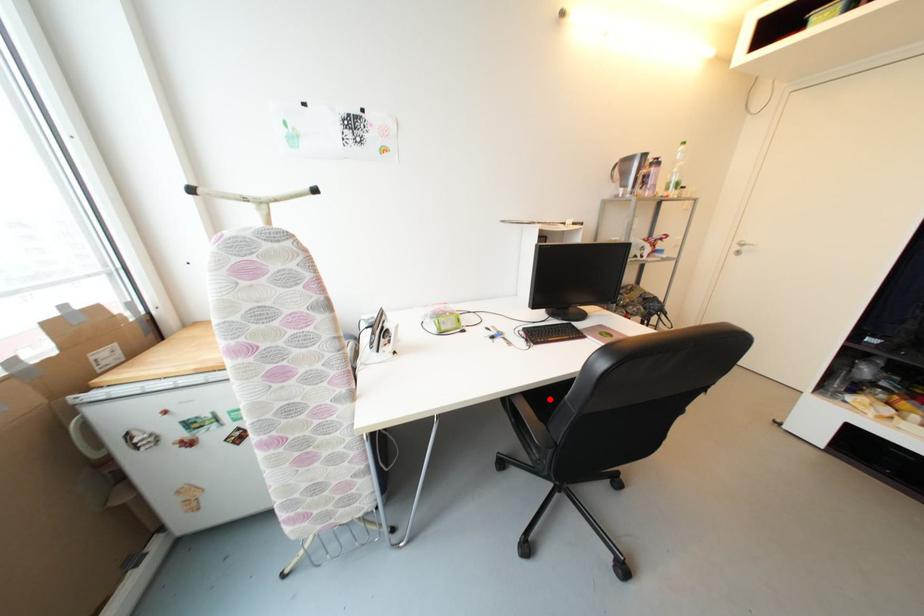
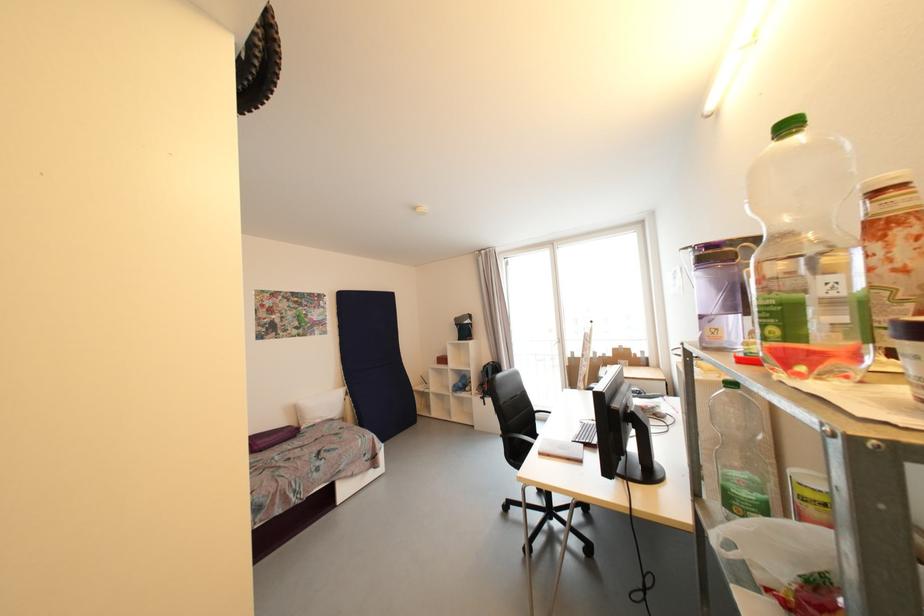
Question: I am providing you with two images of the same scene from different viewpoints. A red point is marked on the first image. Can you still see the location of the red point in image 2?

Choices:
 (A) Yes
 (B) No

Answer: (B)